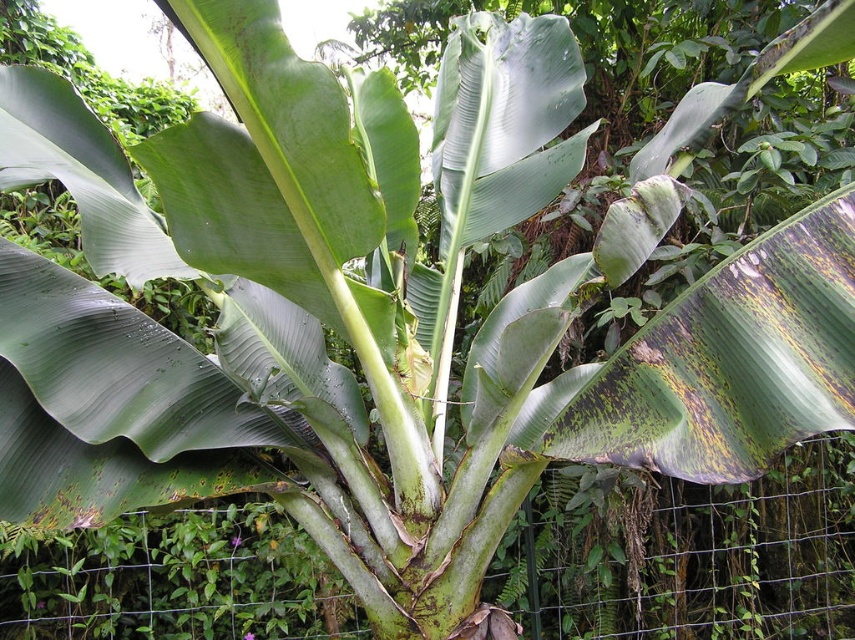
You are a botanist examining the banana plant. You notice two leaves, the green smooth leaf at center and the green matte leaf at upper left. Which leaf is located to the right of the other?

The green smooth leaf at center is positioned on the right side of green matte leaf at upper left.